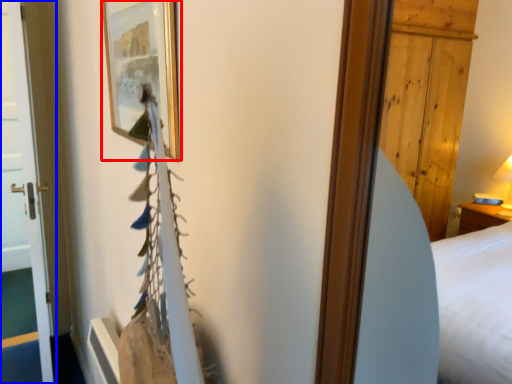
Question: Which of the following is the farthest to the observer, picture frame (highlighted by a red box) or door (highlighted by a blue box)?

Choices:
 (A) picture frame
 (B) door

Answer: (B)